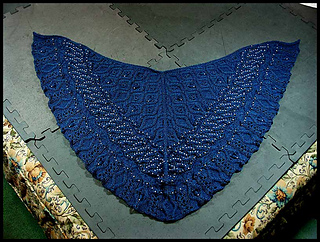
Identify the location of cushion. The image size is (320, 242). (115, 58), (158, 26), (284, 116), (259, 165).